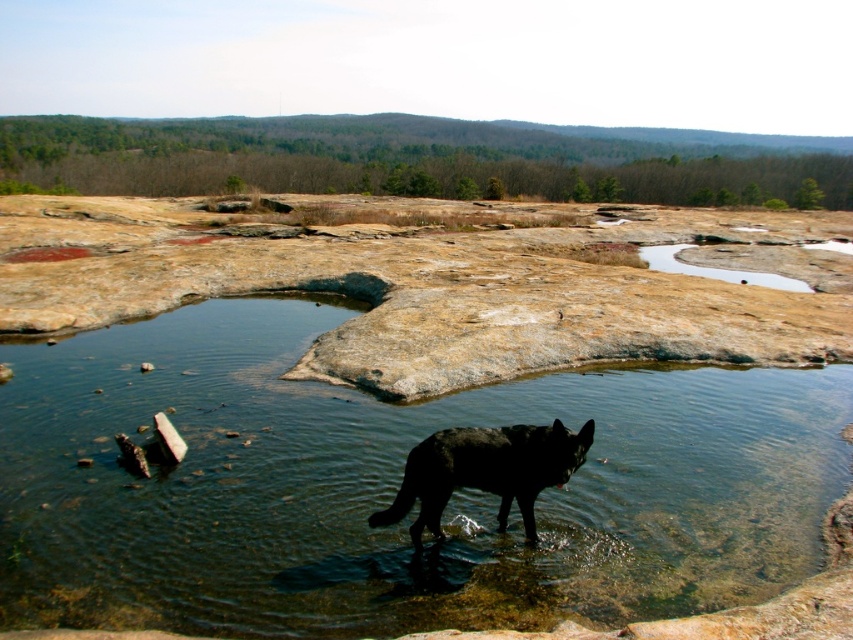
Question: Which point appears farthest from the camera in this image?

Choices:
 (A) (453, 483)
 (B) (173, 618)

Answer: (A)

Question: Is clear water at center positioned in front of black fur dog at lower center?

Choices:
 (A) no
 (B) yes

Answer: (B)

Question: Does clear water at center lie in front of black fur dog at lower center?

Choices:
 (A) yes
 (B) no

Answer: (A)

Question: Does clear water at center appear on the right side of black fur dog at lower center?

Choices:
 (A) yes
 (B) no

Answer: (B)